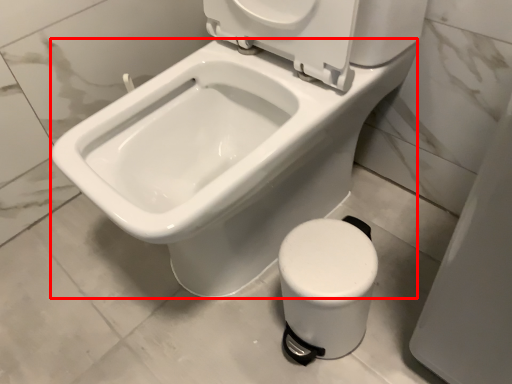
Question: In this image, where is bidet (annotated by the red box) located relative to toilet?

Choices:
 (A) left
 (B) right

Answer: (A)